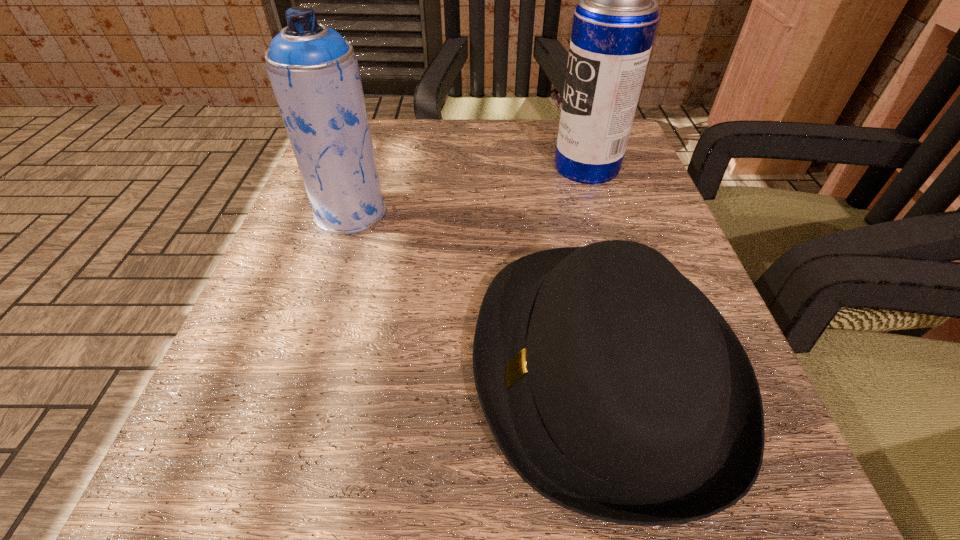
Identify the location of vacant area that lies between the farthest object and the leftmost object. The height and width of the screenshot is (540, 960). (468, 190).

Identify the location of vacant area that lies between the leftmost object and the shortest object. (477, 289).

Image resolution: width=960 pixels, height=540 pixels. I want to click on vacant space in between the leftmost object and the shortest object, so click(x=477, y=289).

What are the coordinates of `free area in between the shortest object and the leftmost object` in the screenshot? It's located at (477, 289).

At what (x,y) coordinates should I click in order to perform the action: click on empty space between the left aerosol can and the farther aerosol can. Please return your answer as a coordinate pair (x, y). The image size is (960, 540). Looking at the image, I should click on (468, 190).

The height and width of the screenshot is (540, 960). I want to click on vacant area that lies between the nearest object and the second farthest object, so click(x=477, y=289).

Locate which object ranks second in proximity to the leftmost object. Please provide its 2D coordinates. Your answer should be formatted as a tuple, i.e. [(x, y)], where the tuple contains the x and y coordinates of a point satisfying the conditions above.

[(614, 25)]

Point out which object is positioned as the nearest to the fedora. Please provide its 2D coordinates. Your answer should be formatted as a tuple, i.e. [(x, y)], where the tuple contains the x and y coordinates of a point satisfying the conditions above.

[(313, 70)]

Find the location of `free space that satisfies the following two spatial constraints: 1. on the label side of the farthest object; 2. on the front side of the left aerosol can`. free space that satisfies the following two spatial constraints: 1. on the label side of the farthest object; 2. on the front side of the left aerosol can is located at coordinates (601, 212).